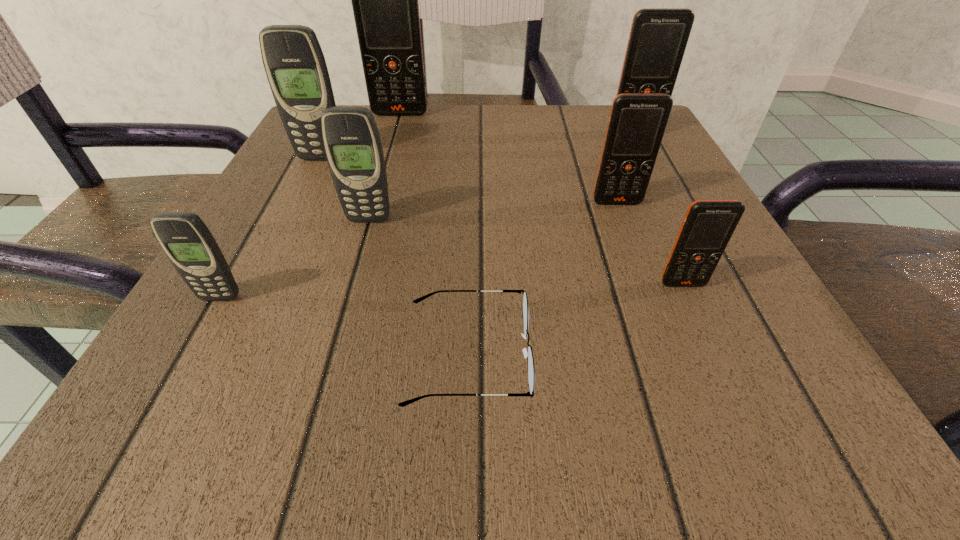
In the image, there is a desktop. Where is `free space at the near right corner`? The width and height of the screenshot is (960, 540). free space at the near right corner is located at coordinates (789, 411).

Identify the location of vacant area that lies between the third farthest orange cellular telephone and the black spectacles. (542, 279).

Identify the location of free space between the third nearest orange cellular telephone and the second nearest object. The width and height of the screenshot is (960, 540). (427, 215).

The width and height of the screenshot is (960, 540). I want to click on vacant region between the biggest gray cellular telephone and the nearest object, so click(395, 256).

At what (x,y) coordinates should I click in order to perform the action: click on unoccupied position between the nearest orange cellular telephone and the second farthest gray cellular telephone. Please return your answer as a coordinate pair (x, y). The image size is (960, 540). Looking at the image, I should click on (526, 252).

Image resolution: width=960 pixels, height=540 pixels. In order to click on vacant space that is in between the fourth farthest object and the smallest orange cellular telephone in this screenshot , I will do `click(650, 243)`.

Where is `free area in between the farthest cellular telephone and the smallest orange cellular telephone`? free area in between the farthest cellular telephone and the smallest orange cellular telephone is located at coordinates (541, 199).

Identify the location of vacant area that lies between the spectacles and the third farthest object. The height and width of the screenshot is (540, 960). (395, 256).

The height and width of the screenshot is (540, 960). Find the location of `the closest object to the third smallest orange cellular telephone`. the closest object to the third smallest orange cellular telephone is located at coordinates (637, 123).

Where is `object that is the sixth nearest to the third biggest orange cellular telephone`? The height and width of the screenshot is (540, 960). object that is the sixth nearest to the third biggest orange cellular telephone is located at coordinates (294, 63).